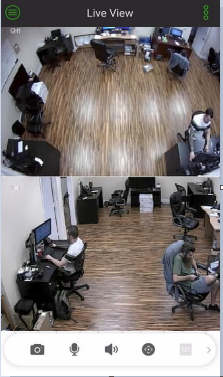
What are the coordinates of `black desk` in the screenshot? It's located at (199, 197).